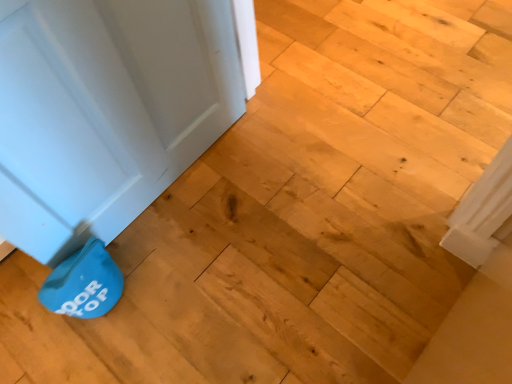
You are a GUI agent. You are given a task and a screenshot of the screen. Output one action in this format:
    pyautogui.click(x=<x>, y=<y>)
    Task: Click on the free point below matte blue door at lower left (from a real-world perspective)
    The image size is (512, 384).
    Given the screenshot: What is the action you would take?
    pyautogui.click(x=172, y=182)